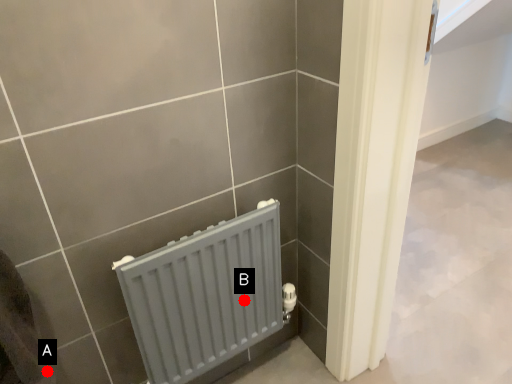
Question: Two points are circled on the image, labeled by A and B beside each circle. Which point is further to the camera?

Choices:
 (A) A is further
 (B) B is further

Answer: (B)